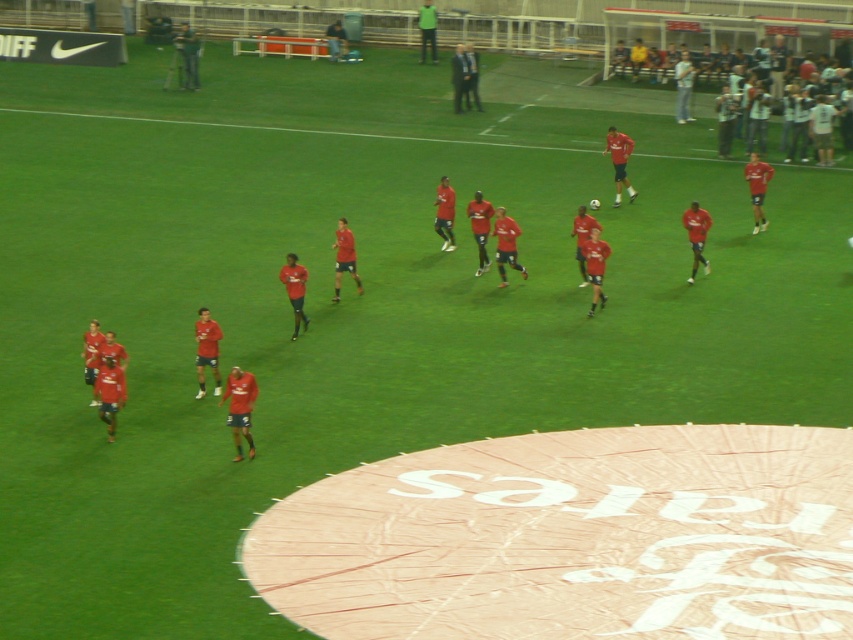
Which is more to the left, matte red shirt at upper right or green matte shirt at upper center?

Positioned to the left is green matte shirt at upper center.

What are the coordinates of `matte red shirt at upper right` in the screenshot? It's located at (x=683, y=86).

Can you confirm if dark gray suit at center is bigger than green matte shirt at upper center?

Actually, dark gray suit at center might be smaller than green matte shirt at upper center.

Can you confirm if dark gray suit at center is smaller than green matte shirt at upper center?

Yes, dark gray suit at center is smaller than green matte shirt at upper center.

Identify the location of dark gray suit at center. This screenshot has width=853, height=640. (460, 77).

Between green matte shirt at upper center and dark blue jeans at center, which one has less height?

dark blue jeans at center is shorter.

Can you confirm if green matte shirt at upper center is taller than dark blue jeans at center?

Indeed, green matte shirt at upper center has a greater height compared to dark blue jeans at center.

What are the coordinates of `green matte shirt at upper center` in the screenshot? It's located at (427, 29).